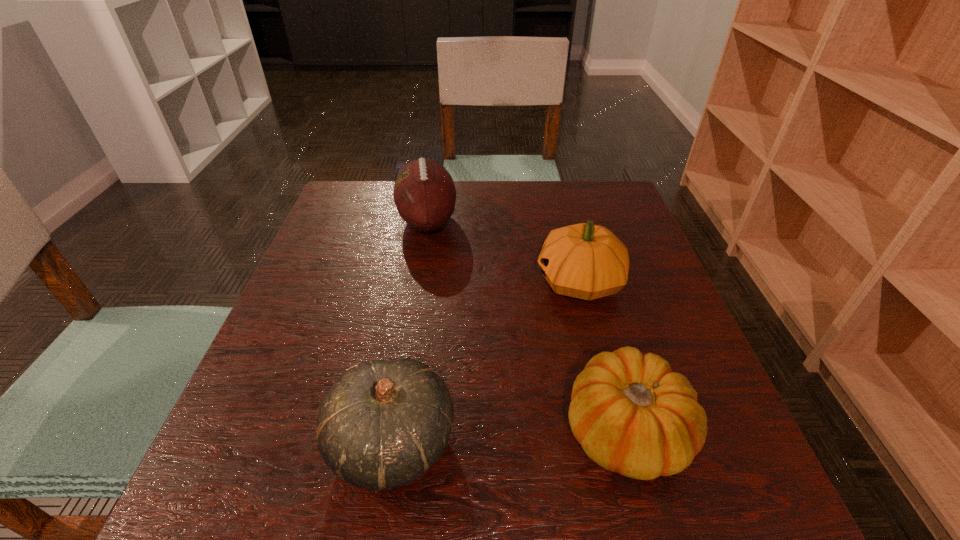
Choose which gourd is the nearest neighbor to the shortest gourd. Please provide its 2D coordinates. Your answer should be formatted as a tuple, i.e. [(x, y)], where the tuple contains the x and y coordinates of a point satisfying the conditions above.

[(586, 261)]

Select which gourd is the second closest to the farthest gourd. Please provide its 2D coordinates. Your answer should be formatted as a tuple, i.e. [(x, y)], where the tuple contains the x and y coordinates of a point satisfying the conditions above.

[(383, 423)]

Locate an element on the screen. free region that satisfies the following two spatial constraints: 1. on the back side of the leftmost gourd; 2. on the left side of the shortest gourd is located at coordinates (395, 431).

This screenshot has width=960, height=540. In order to click on free space that satisfies the following two spatial constraints: 1. on the side of the farthest gourd with the carved face; 2. on the right side of the shortest object in this screenshot , I will do click(617, 431).

Image resolution: width=960 pixels, height=540 pixels. In order to click on vacant position in the image that satisfies the following two spatial constraints: 1. on the front side of the shortest gourd; 2. on the right side of the farthest object in this screenshot , I will do `click(394, 431)`.

You are a GUI agent. You are given a task and a screenshot of the screen. Output one action in this format:
    pyautogui.click(x=<x>, y=<y>)
    Task: Click on the free space that satisfies the following two spatial constraints: 1. on the front side of the farthest object; 2. on the left side of the leftmost gourd
    Image resolution: width=960 pixels, height=540 pixels.
    Given the screenshot: What is the action you would take?
    pyautogui.click(x=392, y=441)

Find the location of a particular element. vacant space that satisfies the following two spatial constraints: 1. on the side of the shortest object with the carved face; 2. on the right side of the third nearest object is located at coordinates (617, 431).